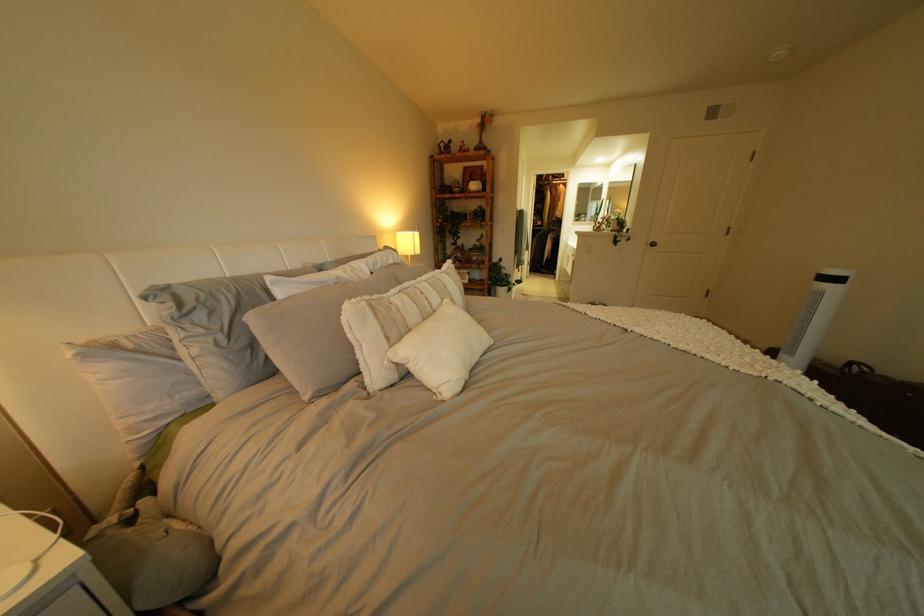
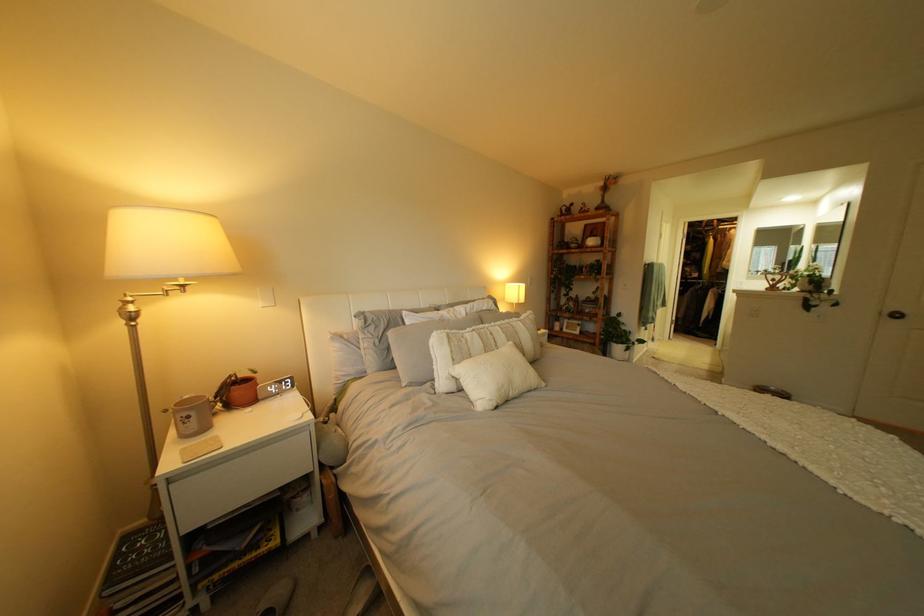
Find the pixel in the second image that matches [451,294] in the first image.

(518, 337)